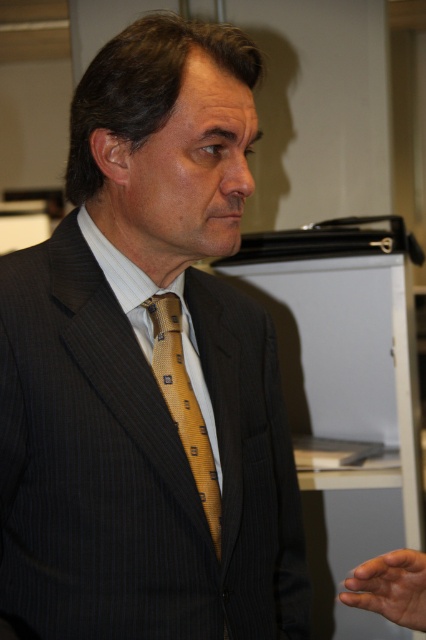
The man is wearing a pinstriped suit at center and a white silk dress shirt at center. Which clothing item is visible on top?

The pinstriped suit at center is positioned over the white silk dress shirt at center, so the pinstriped suit at center is visible on top.

You are a tailor who needs to adjust the pinstriped suit at center and the white silk dress shirt at center to ensure they fit properly. Based on the image, which garment requires more alterations to accommodate its current size?

The pinstriped suit at center is bigger than the white silk dress shirt at center, so the pinstriped suit at center requires more alterations to reduce its size for a proper fit.